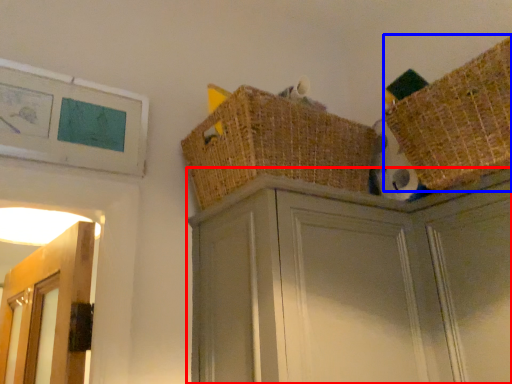
Question: Which object is further to the camera taking this photo, cabinetry (highlighted by a red box) or basket (highlighted by a blue box)?

Choices:
 (A) cabinetry
 (B) basket

Answer: (B)